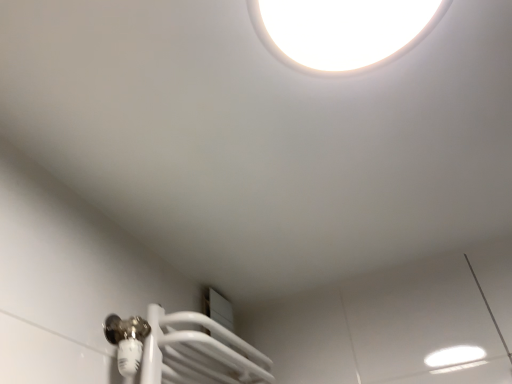
Locate an element on the screen. The image size is (512, 384). white glossy light fixture at upper center is located at coordinates (342, 31).

This screenshot has width=512, height=384. What do you see at coordinates (342, 31) in the screenshot?
I see `white glossy light fixture at upper center` at bounding box center [342, 31].

Measure the distance between point (344, 59) and camera.

Point (344, 59) and camera are 26.30 inches apart.

Where is `white glossy light fixture at upper center`? white glossy light fixture at upper center is located at coordinates (342, 31).